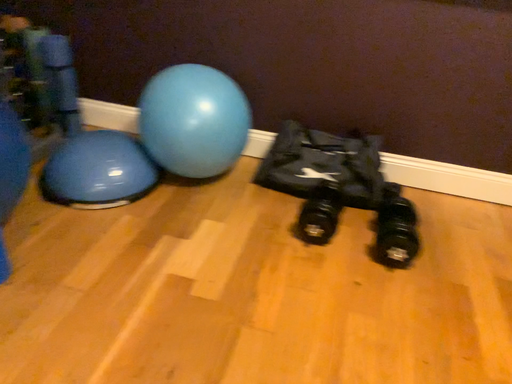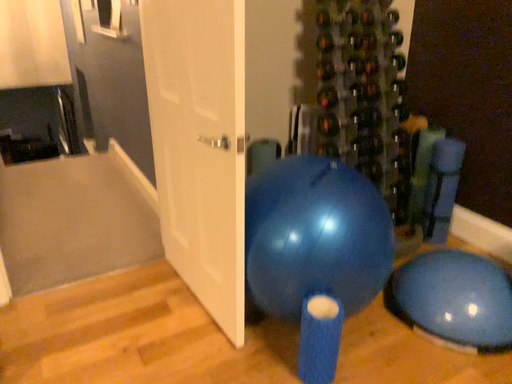
Question: How did the camera likely rotate when shooting the video?

Choices:
 (A) rotated downward
 (B) rotated upward

Answer: (B)